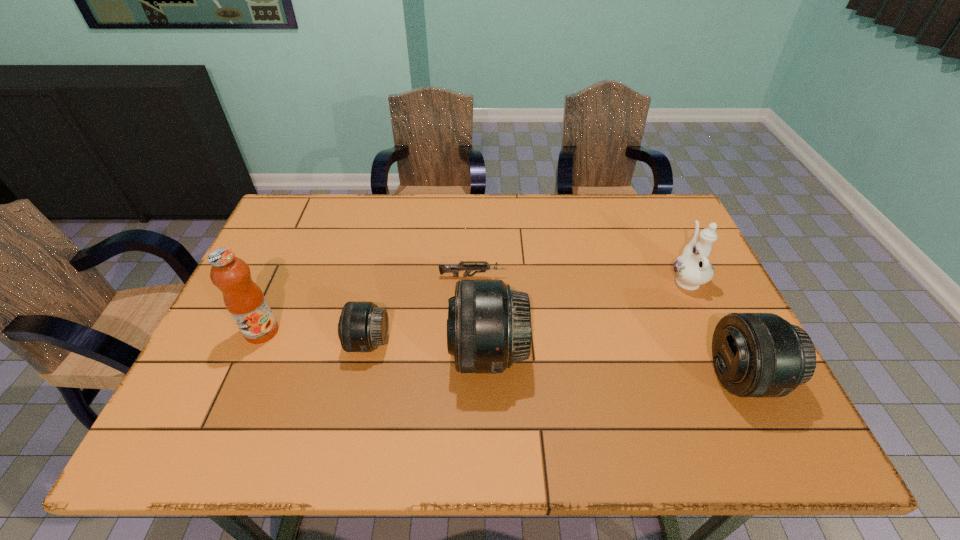
Where is `free region at the right edge of the desktop`? free region at the right edge of the desktop is located at coordinates (717, 307).

Locate an element on the screen. This screenshot has width=960, height=540. vacant space at the far left corner is located at coordinates (297, 217).

Locate an element on the screen. The width and height of the screenshot is (960, 540). vacant space at the far right corner of the desktop is located at coordinates (626, 194).

This screenshot has width=960, height=540. What are the coordinates of `empty space that is in between the fifth object from right to left and the shortest object` in the screenshot? It's located at (420, 309).

The height and width of the screenshot is (540, 960). What are the coordinates of `free space between the fifth object from right to left and the rightmost telephoto lens` in the screenshot? It's located at (556, 360).

Locate an element on the screen. vacant space that's between the second telephoto lens from left to right and the chinaware is located at coordinates [x=587, y=316].

I want to click on unoccupied position between the chinaware and the gun, so click(579, 278).

I want to click on empty location between the shortest telephoto lens and the second telephoto lens from left to right, so 428,348.

Find the location of `vacant area that lies between the shortest object and the chinaware`. vacant area that lies between the shortest object and the chinaware is located at coordinates (579, 278).

This screenshot has width=960, height=540. In order to click on free space between the chinaware and the second telephoto lens from left to right in this screenshot , I will do `click(587, 316)`.